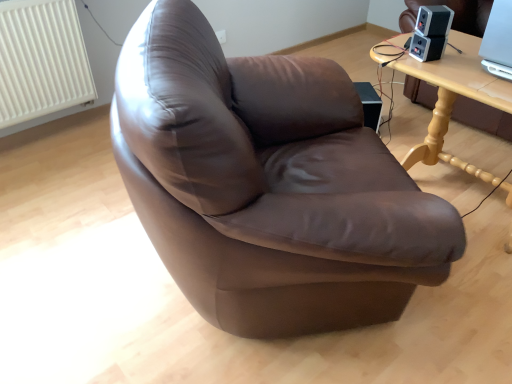
Image resolution: width=512 pixels, height=384 pixels. Identify the location of free space in front of satin black speaker at upper right, the 1th speaker when ordered from bottom to top. (444, 71).